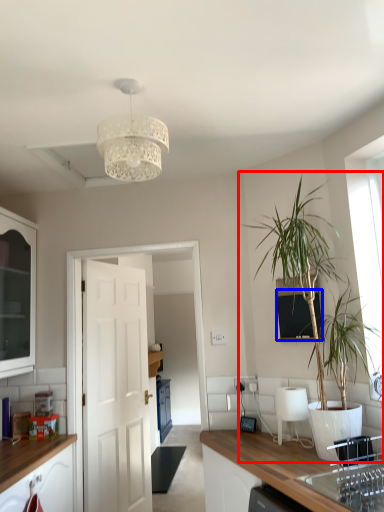
Question: Which point is closer to the camera, houseplant (highlighted by a red box) or window screen (highlighted by a blue box)?

Choices:
 (A) houseplant
 (B) window screen

Answer: (A)